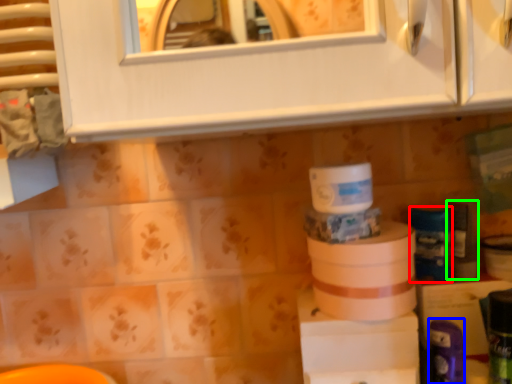
Question: Estimate the real-world distances between objects in this image. Which object is closer to toiletry (highlighted by a red box), toiletry (highlighted by a blue box) or toiletry (highlighted by a green box)?

Choices:
 (A) toiletry
 (B) toiletry

Answer: (B)